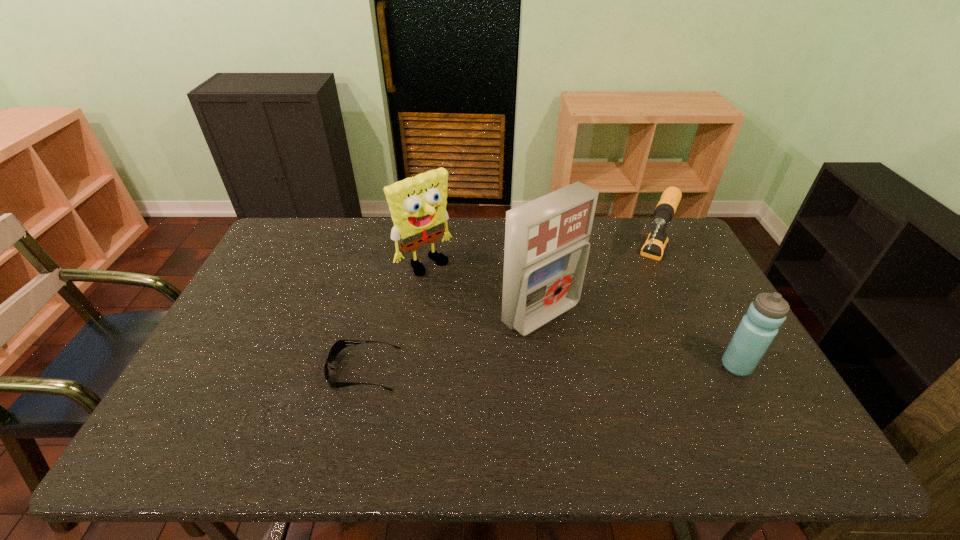
Where is `drill positioned at the far edge`? Image resolution: width=960 pixels, height=540 pixels. drill positioned at the far edge is located at coordinates (655, 245).

Find the location of a particular element. The width and height of the screenshot is (960, 540). object that is at the near edge is located at coordinates (338, 346).

Find the location of a particular element. The height and width of the screenshot is (540, 960). water bottle at the right edge is located at coordinates (757, 329).

Locate an element on the screen. drill positioned at the right edge is located at coordinates (655, 245).

The width and height of the screenshot is (960, 540). What are the coordinates of `object at the far right corner` in the screenshot? It's located at (655, 245).

At what (x,y) coordinates should I click in order to perform the action: click on vacant space at the far edge of the desktop. Please return your answer as a coordinate pair (x, y). This screenshot has width=960, height=540. Looking at the image, I should click on (361, 219).

Locate an element on the screen. vacant position at the near edge of the desktop is located at coordinates (260, 405).

In the image, there is a desktop. Where is `free region at the left edge`? free region at the left edge is located at coordinates (237, 380).

At what (x,y) coordinates should I click in order to perform the action: click on vacant space at the right edge of the desktop. Please return your answer as a coordinate pair (x, y). This screenshot has width=960, height=540. Looking at the image, I should click on (666, 262).

In the image, there is a desktop. At what (x,y) coordinates should I click in order to perform the action: click on free space at the near left corner. Please return your answer as a coordinate pair (x, y). Looking at the image, I should click on (223, 409).